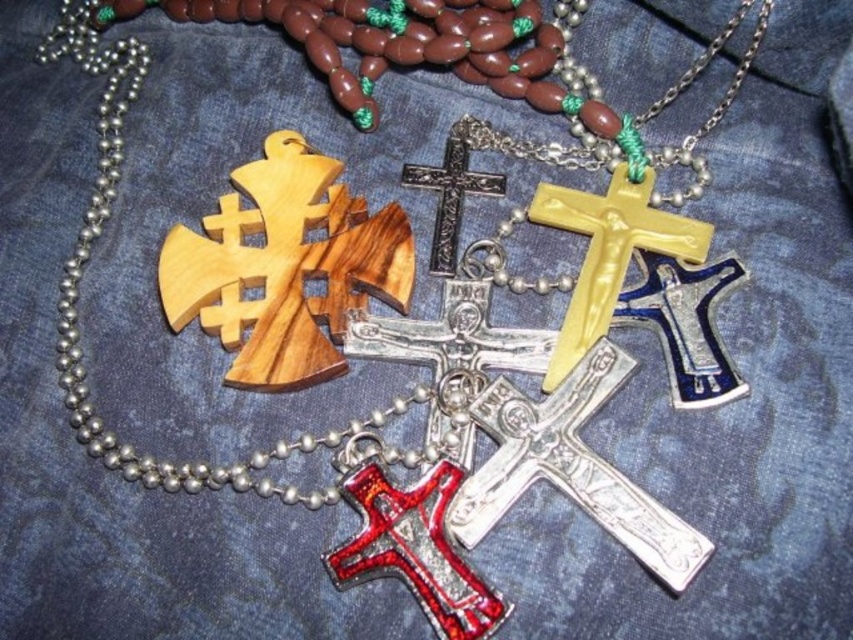
You are a jeweler organizing a display of religious pendants. You have two silver crosses in the center of the display. How far apart are the silver metallic cross at center and the metallic silver cross at center?

The silver metallic cross at center and the metallic silver cross at center are 12.06 inches apart.

You are an art curator arranging a display of religious pendants. You need to ensure that the shiny red cross at center and the yellow glossy crucifix at center are visible to visitors standing at the front of the display. Considering their heights, which pendant will appear shorter?

The shiny red cross at center appears shorter than the yellow glossy crucifix at center because it has a lesser height compared to it.

You are a customer in a jewelry store looking at the shiny red cross at center and the yellow glossy crucifix at center. Which one do you see first when you look at the display?

The shiny red cross at center is in front of the yellow glossy crucifix at center, so you will see the shiny red cross at center first when looking at the display.